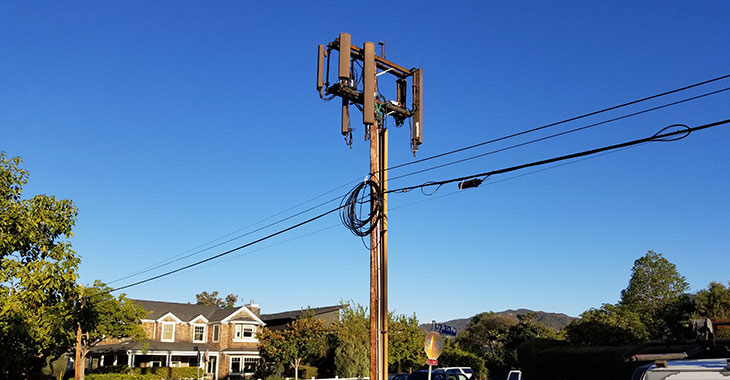
You are a GUI agent. You are given a task and a screenshot of the screen. Output one action in this format:
    pyautogui.click(x=<x>, y=<y>)
    Task: Click on the window
    The image size is (730, 380).
    Given the screenshot: What is the action you would take?
    198,331, 214,331, 247,326, 245,359, 238,366, 158,359